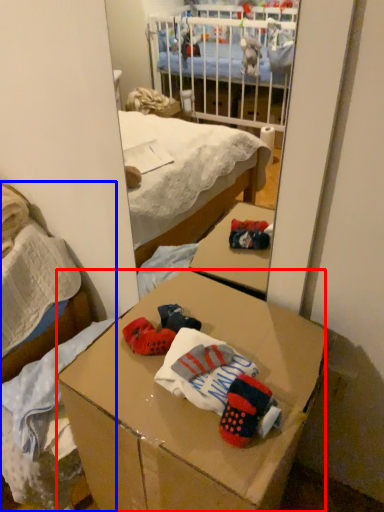
Question: Which of the following is the closest to the observer, desk (highlighted by a red box) or bed (highlighted by a blue box)?

Choices:
 (A) desk
 (B) bed

Answer: (A)